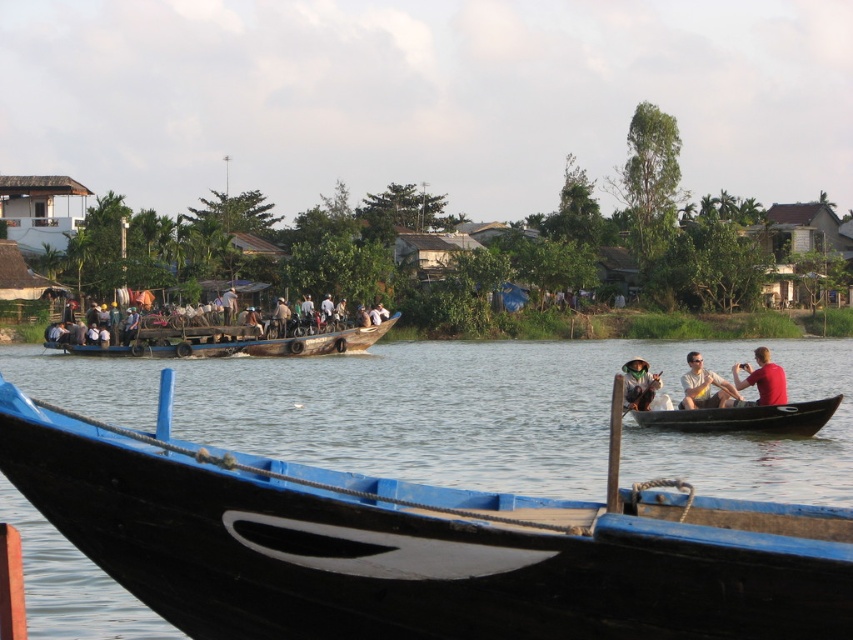
You are standing on a dock and see the black wood canoe at right and the matte green hat at lower right. Which object is closer to you?

The matte green hat at lower right is closer to you because it is positioned above the black wood canoe at right, indicating it is nearer in the visual hierarchy.

You are navigating a small drone over the serene riverside scene. Your mission is to drop a package onto the black wood boat at center. Given that the drone can only release the package when it is directly above the boat, can you confirm the exact coordinates where you should release the package?

The black wood boat at center is located at point [379,410], so you should release the package directly above those coordinates to ensure it lands on the boat.